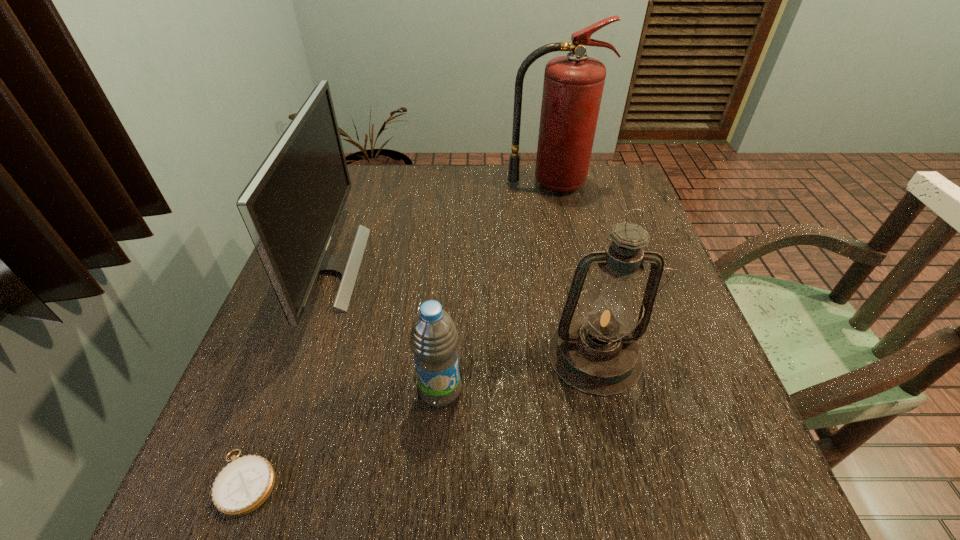
This screenshot has height=540, width=960. I want to click on the tallest object, so click(x=573, y=85).

What are the coordinates of `fire extinguisher` in the screenshot? It's located at (573, 85).

Find the location of a particular element. The width and height of the screenshot is (960, 540). monitor is located at coordinates (291, 206).

Identify the location of oil lamp. This screenshot has width=960, height=540. (597, 352).

This screenshot has height=540, width=960. Find the location of `water bottle`. water bottle is located at coordinates (434, 339).

Locate an element on the screen. This screenshot has width=960, height=540. the fourth tallest object is located at coordinates (434, 339).

Find the location of a particular element. The image size is (960, 540). compass is located at coordinates (242, 486).

I want to click on the shortest object, so [242, 486].

Where is `blank area located at the front of the tallest object where the nozzle is aimed`? This screenshot has width=960, height=540. blank area located at the front of the tallest object where the nozzle is aimed is located at coordinates (562, 237).

This screenshot has width=960, height=540. I want to click on vacant position located on the screen side of the monitor, so click(x=517, y=267).